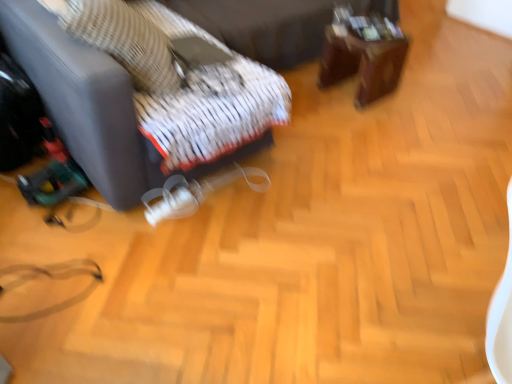
Question: Relative to woven fabric pillow at upper left, is brown wooden table at upper right in front or behind?

Choices:
 (A) behind
 (B) front

Answer: (A)

Question: From a real-world perspective, is brown wooden table at upper right positioned above or below woven fabric pillow at upper left?

Choices:
 (A) below
 (B) above

Answer: (A)

Question: Which object is positioned closest to the matte black suitcase at lower left?

Choices:
 (A) woven fabric pillow at upper left
 (B) white textured fabric bed frame at upper center
 (C) brown wooden table at upper right

Answer: (A)

Question: Which of these objects is positioned farthest from the matte black suitcase at lower left?

Choices:
 (A) woven fabric pillow at upper left
 (B) white textured fabric bed frame at upper center
 (C) brown wooden table at upper right

Answer: (C)